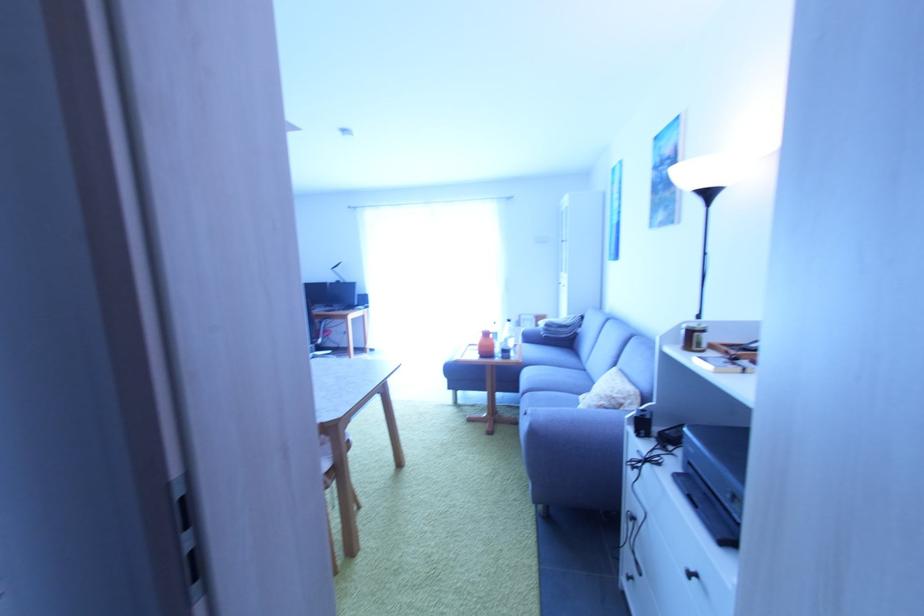
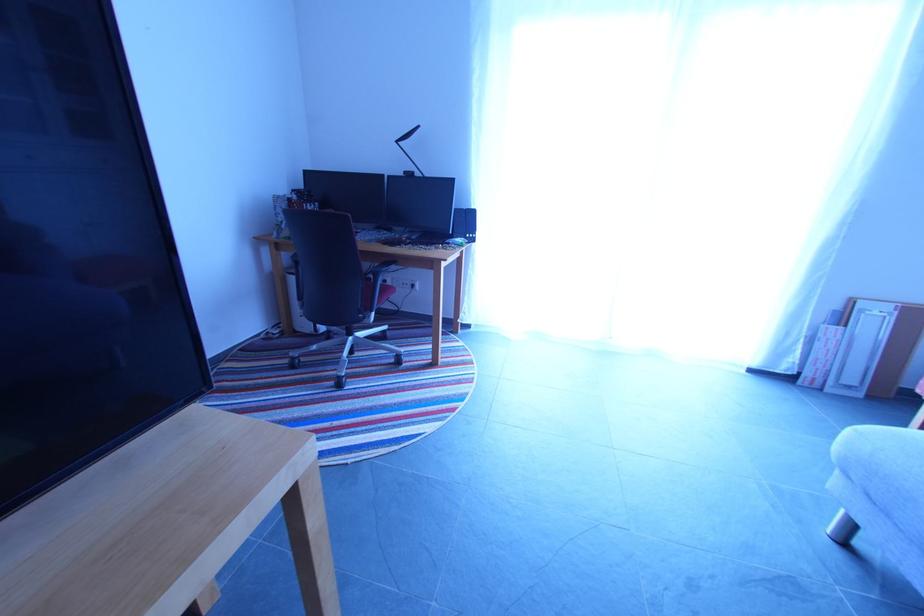
What movement of the cameraman would produce the second image?

The cameraman moved toward left, forward.